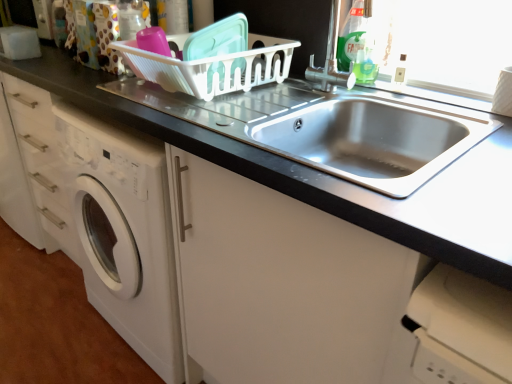
Question: From the image's perspective, does white plastic basket at upper center appear lower than stainless steel sink at center?

Choices:
 (A) no
 (B) yes

Answer: (A)

Question: Can you confirm if white plastic basket at upper center is wider than stainless steel sink at center?

Choices:
 (A) yes
 (B) no

Answer: (B)

Question: Considering the relative sizes of white plastic basket at upper center and stainless steel sink at center in the image provided, is white plastic basket at upper center thinner than stainless steel sink at center?

Choices:
 (A) yes
 (B) no

Answer: (A)

Question: Does white plastic basket at upper center lie in front of stainless steel sink at center?

Choices:
 (A) yes
 (B) no

Answer: (B)

Question: Would you say white plastic basket at upper center is a long distance from stainless steel sink at center?

Choices:
 (A) yes
 (B) no

Answer: (B)

Question: Is stainless steel sink at center inside white plastic basket at upper center?

Choices:
 (A) no
 (B) yes

Answer: (A)

Question: Is satin nickel faucet at upper right looking in the opposite direction of white plastic basket at upper center?

Choices:
 (A) yes
 (B) no

Answer: (B)

Question: Does satin nickel faucet at upper right turn towards white plastic basket at upper center?

Choices:
 (A) no
 (B) yes

Answer: (A)

Question: Is satin nickel faucet at upper right at the right side of white plastic basket at upper center?

Choices:
 (A) no
 (B) yes

Answer: (B)

Question: Is satin nickel faucet at upper right thinner than white plastic basket at upper center?

Choices:
 (A) no
 (B) yes

Answer: (B)

Question: Considering the relative sizes of satin nickel faucet at upper right and white plastic basket at upper center in the image provided, is satin nickel faucet at upper right smaller than white plastic basket at upper center?

Choices:
 (A) no
 (B) yes

Answer: (B)

Question: Does satin nickel faucet at upper right have a lesser height compared to white plastic basket at upper center?

Choices:
 (A) yes
 (B) no

Answer: (B)

Question: From a real-world perspective, is white plastic basket at upper center on green plastic bottle at upper right?

Choices:
 (A) no
 (B) yes

Answer: (A)